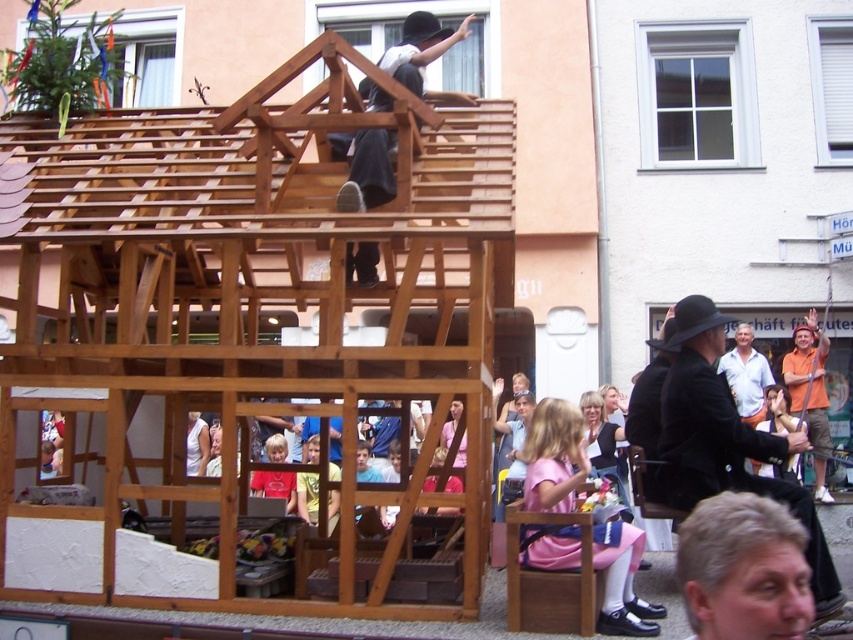
Where is `light brown wooden chair at lower right`? light brown wooden chair at lower right is located at coordinates (779, 412).

Between light brown wooden chair at lower right and yellow fabric at lower center, which one has more height?

With more height is yellow fabric at lower center.

Identify the location of light brown wooden chair at lower right. The image size is (853, 640). (779, 412).

You are a GUI agent. You are given a task and a screenshot of the screen. Output one action in this format:
    pyautogui.click(x=<x>, y=<y>)
    Task: Click on the natural wood house at upper center
    This screenshot has height=640, width=853.
    Given the screenshot: What is the action you would take?
    pyautogui.click(x=245, y=316)

Does point (216, 257) lie behind point (332, 508)?

Yes, point (216, 257) is behind point (332, 508).

Where is `natural wood house at upper center`? The width and height of the screenshot is (853, 640). natural wood house at upper center is located at coordinates (245, 316).

Describe the element at coordinates (724, 440) in the screenshot. I see `black matte hat at center` at that location.

Which is above, black matte hat at center or yellow fabric at lower center?

black matte hat at center

Is point (715, 392) positioned after point (334, 477)?

No.

This screenshot has height=640, width=853. Find the location of `black matte hat at center`. black matte hat at center is located at coordinates (724, 440).